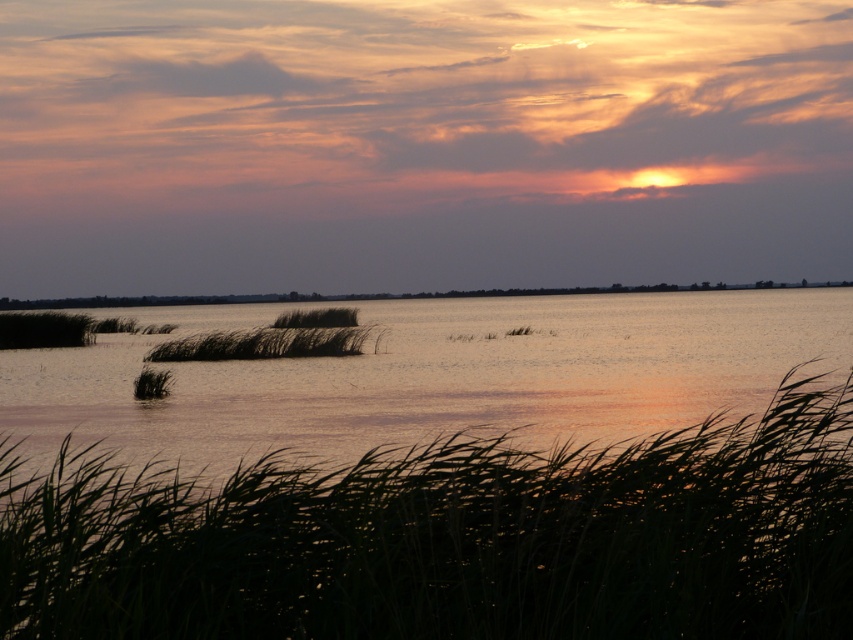
You are standing at the edge of the water and want to reach the smooth water at center without stepping on the green grass at center. Is this possible?

The green grass at center is closer to the viewer than the smooth water at center, so you would have to step over or around the green grass at center to reach the smooth water at center.

You are standing at the edge of the water and see the silvery reeds at lower left and the silvery grass at center. Which one is closer to your right side?

The silvery reeds at lower left are to the right of the silvery grass at center, so if you are facing the water, the silvery reeds at lower left would be closer to your right side.